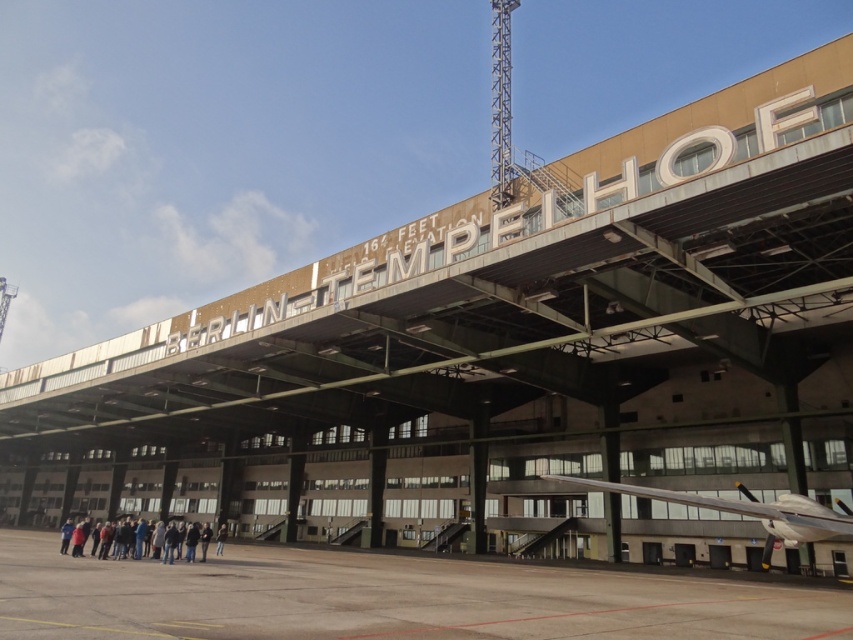
You are standing in front of the BERLIN TEMPELHOF building and see the gray concrete tarmac at lower center and the dark blue jeans at lower center. Which object is located to the right of the other?

The gray concrete tarmac at lower center is positioned on the right side of dark blue jeans at lower center.

You are a photographer standing in front of the BERLIN TEMPELHOF building and want to capture a photo of the dark blue jeans at lower center and the gray concrete tarmac at lower center. Which object will occupy more space in your photo?

The gray concrete tarmac at lower center is larger in size than the dark blue jeans at lower center, so the gray concrete tarmac at lower center will occupy more space in the photo.

You are standing in front of the BERLIN TEMPELHOF building and see the white glossy airplane at lower right. If you want to walk to the airplane, how many steps would you need to take if each step is 0.75 meters long?

The white glossy airplane at lower right is 16.77 meters away. Dividing the distance by the step length of 0.75 meters gives approximately 22.36 steps. Since you can only take whole steps, you would need to take 23 steps to reach the airplane.